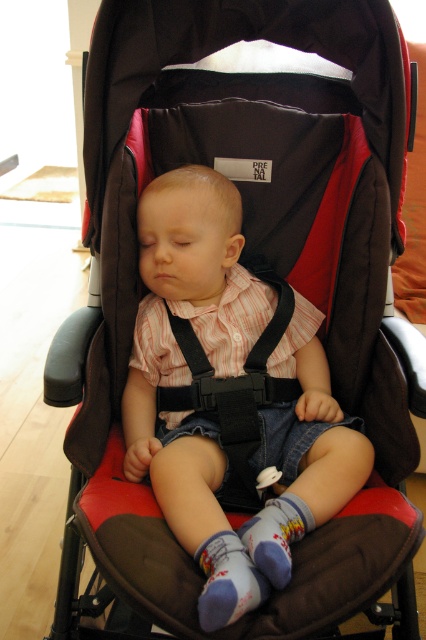
You are a babysitter checking the baby in the stroller. You see the black fabric strap at center and the purple soft socks at lower center. Which object is located to the right of the other?

The black fabric strap at center is positioned on the right side of purple soft socks at lower center.

You are a parent holding a small toy that is 8 inches long. You want to place it between the matte pink shirt at center and the printed cotton sock at center so that it touches both. Is this possible?

The distance between the matte pink shirt at center and the printed cotton sock at center is 9.27 inches. The toy is 8 inches long, which is shorter than the distance between them. Therefore, the toy can be placed between them to touch both items.

Based on the photo, you are a caregiver checking the baby in the stroller. You notice the black fabric strap at center and the purple soft socks at lower center. Which item is bigger in size?

The black fabric strap at center is larger in size than the purple soft socks at lower center.